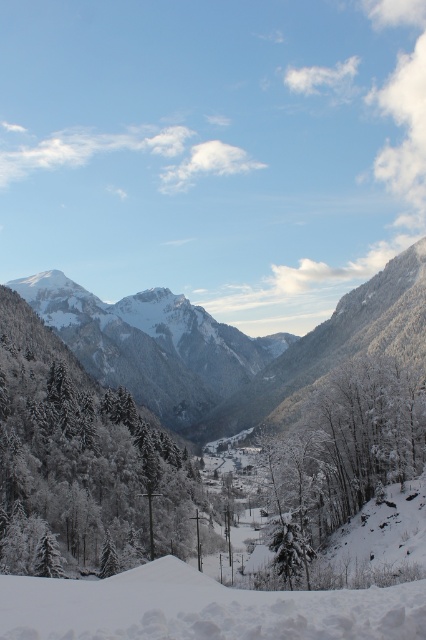
You are an artist planning to paint this winter landscape. You want to emphasize the green matte tree at left and the white frosty trees at center. Which tree should you paint first to ensure proper layering, considering their sizes?

The green matte tree at left is larger than the white frosty trees at center, so you should paint the green matte tree at left first to establish the main structure before adding the smaller white frosty trees at center in the foreground or background as needed.

You are standing in the winter landscape and want to reach the two points marked in the image. Which point, point (x=161, y=452) or point (x=124, y=320), is closer to you?

Point (x=161, y=452) is closer to the viewer than point (x=124, y=320).